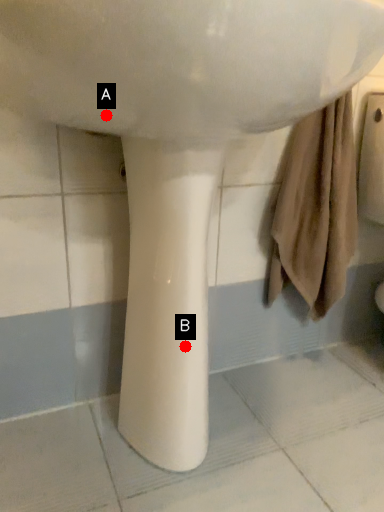
Question: Two points are circled on the image, labeled by A and B beside each circle. Among these points, which one is nearest to the camera?

Choices:
 (A) A is closer
 (B) B is closer

Answer: (A)